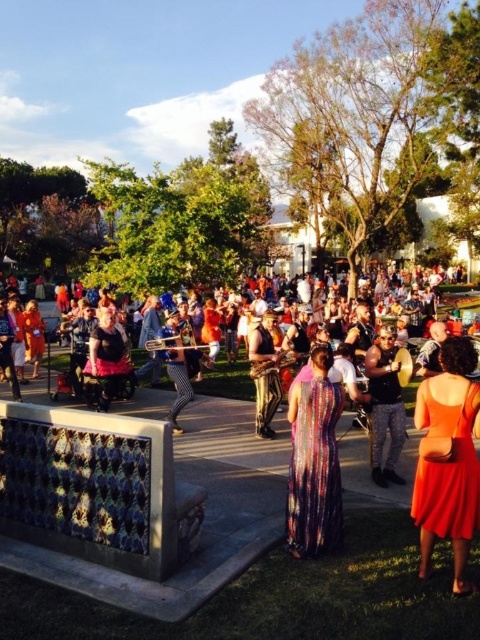
Question: Which point is closer to the camera?

Choices:
 (A) multicolored fabric dress at center
 (B) shiny gold pants at center
 (C) camouflage pants at center

Answer: (A)

Question: Is multicolored fabric dress at center to the left of camouflage pants at center from the viewer's perspective?

Choices:
 (A) yes
 (B) no

Answer: (A)

Question: Can you confirm if multicolored fabric dress at center is smaller than camouflage pants at center?

Choices:
 (A) no
 (B) yes

Answer: (A)

Question: Based on their relative distances, which object is nearer to the camouflage pants at center?

Choices:
 (A) orange satin dress at center
 (B) multicolored sequined dress at center
 (C) multicolored fabric dress at center

Answer: (B)

Question: Which object is the farthest from the camouflage pants at center?

Choices:
 (A) shiny gold pants at center
 (B) multicolored fabric dress at center
 (C) multicolored sequined dress at center
 (D) orange satin dress at center

Answer: (D)

Question: Does orange satin dress at center appear over camouflage pants at center?

Choices:
 (A) yes
 (B) no

Answer: (B)